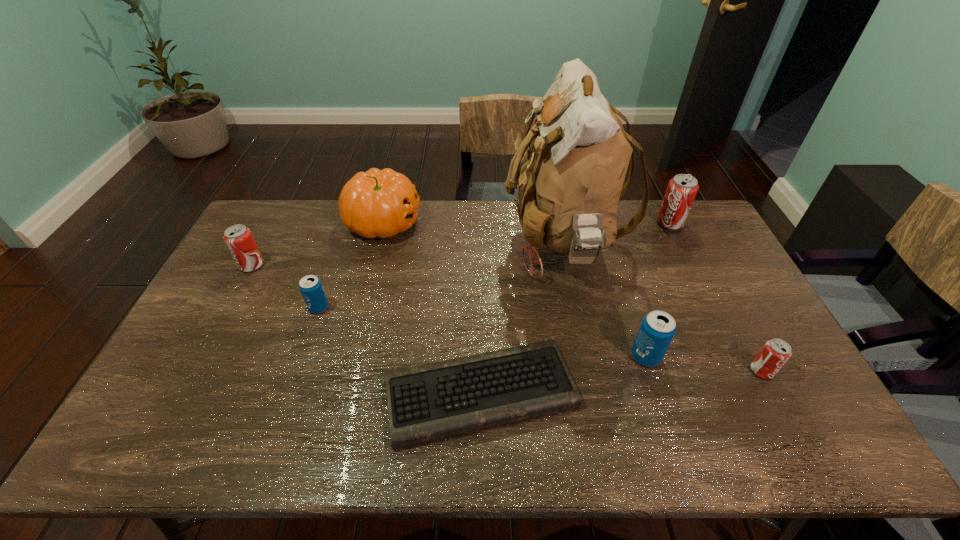
Find the location of a particular element. The image size is (960, 540). free space that satisfies the following two spatial constraints: 1. on the carved face of the farthest pink soda can; 2. on the left side of the pumpkin is located at coordinates (383, 223).

Locate an element on the screen. This screenshot has height=540, width=960. free space that satisfies the following two spatial constraints: 1. on the front side of the nearer blue soda can; 2. on the right side of the nearest pink soda can is located at coordinates (651, 371).

Locate an element on the screen. The width and height of the screenshot is (960, 540). vacant space that satisfies the following two spatial constraints: 1. on the carved face of the orange pumpkin; 2. on the right side of the smallest pink soda can is located at coordinates (346, 371).